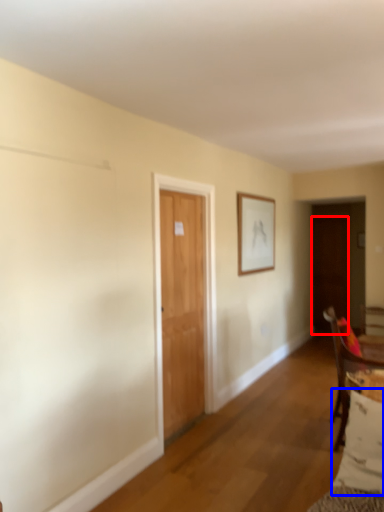
Question: Among these objects, which one is nearest to the camera, door (highlighted by a red box) or pillow (highlighted by a blue box)?

Choices:
 (A) door
 (B) pillow

Answer: (B)